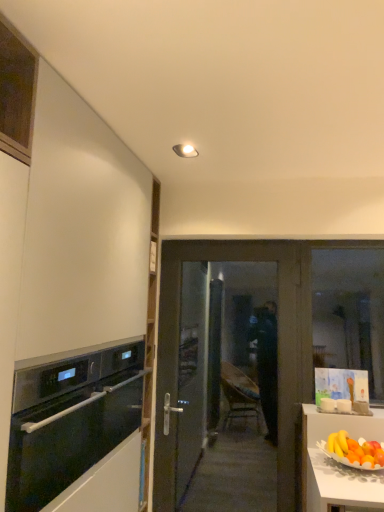
Question: Is matte dark brown door at center positioned in front of transparent glass window at right?

Choices:
 (A) yes
 (B) no

Answer: (A)

Question: Can you confirm if matte dark brown door at center is shorter than transparent glass window at right?

Choices:
 (A) yes
 (B) no

Answer: (B)

Question: From a real-world perspective, is matte dark brown door at center beneath transparent glass window at right?

Choices:
 (A) yes
 (B) no

Answer: (A)

Question: Can you confirm if matte dark brown door at center is wider than transparent glass window at right?

Choices:
 (A) yes
 (B) no

Answer: (A)

Question: Is matte dark brown door at center taller than transparent glass window at right?

Choices:
 (A) yes
 (B) no

Answer: (A)

Question: In terms of width, does transparent glass window at right look wider or thinner when compared to black glass oven at left?

Choices:
 (A) wide
 (B) thin

Answer: (B)

Question: From the image's perspective, is transparent glass window at right positioned above or below black glass oven at left?

Choices:
 (A) below
 (B) above

Answer: (B)

Question: Is transparent glass window at right bigger or smaller than black glass oven at left?

Choices:
 (A) small
 (B) big

Answer: (A)

Question: Based on their positions, is transparent glass window at right located to the left or right of black glass oven at left?

Choices:
 (A) right
 (B) left

Answer: (A)

Question: Would you say matte white ceiling light at upper center is inside or outside transparent glass window at right?

Choices:
 (A) outside
 (B) inside

Answer: (A)

Question: Considering their positions, is matte white ceiling light at upper center located in front of or behind transparent glass window at right?

Choices:
 (A) front
 (B) behind

Answer: (A)

Question: Is point (198, 155) closer or farther from the camera than point (359, 289)?

Choices:
 (A) closer
 (B) farther

Answer: (A)

Question: From a real-world perspective, relative to transparent glass window at right, is matte white ceiling light at upper center vertically above or below?

Choices:
 (A) above
 (B) below

Answer: (A)

Question: Considering the positions of matte dark brown door at center and transparent glass window at right in the image, is matte dark brown door at center bigger or smaller than transparent glass window at right?

Choices:
 (A) small
 (B) big

Answer: (B)

Question: In the image, is matte dark brown door at center positioned in front of or behind transparent glass window at right?

Choices:
 (A) front
 (B) behind

Answer: (A)